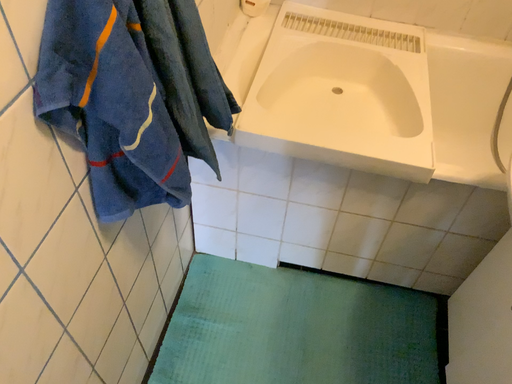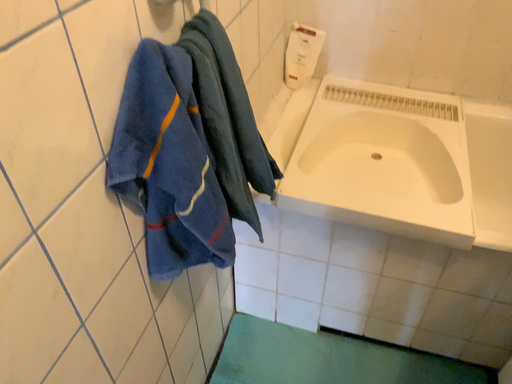
Question: How did the camera likely rotate when shooting the video?

Choices:
 (A) rotated upward
 (B) rotated downward

Answer: (A)